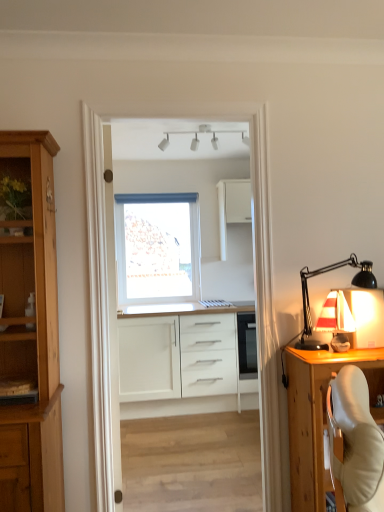
Image resolution: width=384 pixels, height=512 pixels. I want to click on free space to the left of matte white sailboat at right, so click(x=310, y=349).